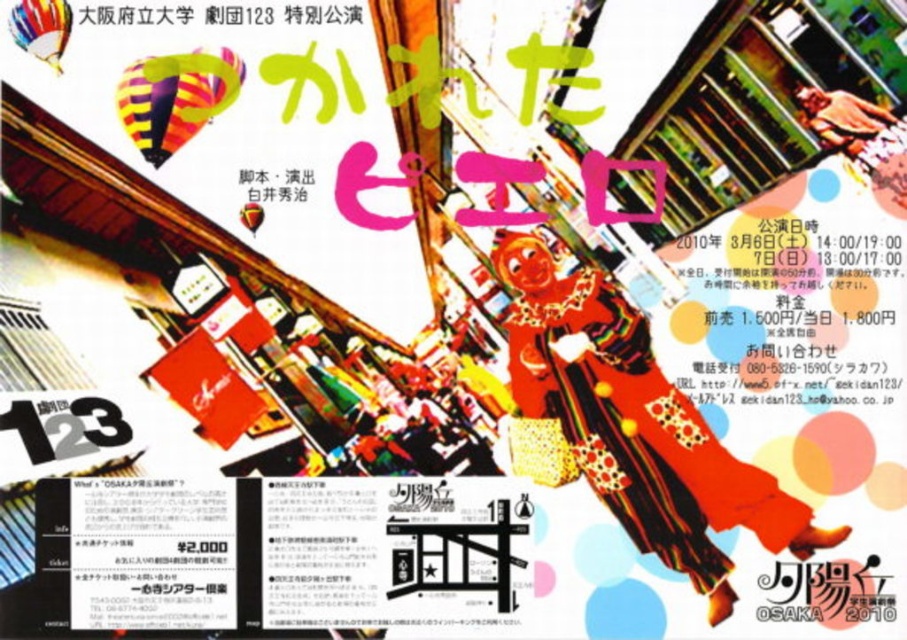
Can you confirm if matte red poster at center is wider than multicolored striped balloon at upper left?

Yes.

Between matte red poster at center and multicolored striped balloon at upper left, which one appears on the left side from the viewer's perspective?

From the viewer's perspective, multicolored striped balloon at upper left appears more on the left side.

Does point (427, 316) come behind point (163, 118)?

Yes, point (427, 316) is behind point (163, 118).

I want to click on matte red poster at center, so click(x=252, y=132).

Does point (272, 156) come in front of point (33, 32)?

No, it is behind (33, 32).

Is point (296, 273) positioned after point (45, 4)?

Yes, it is.

The height and width of the screenshot is (640, 907). I want to click on matte red poster at center, so click(252, 132).

This screenshot has height=640, width=907. I want to click on matte red poster at center, so click(x=252, y=132).

Can you confirm if multicolored striped balloon at upper left is positioned below rainbow striped balloon at upper left?

Indeed, multicolored striped balloon at upper left is positioned under rainbow striped balloon at upper left.

Which is in front, point (151, 122) or point (42, 44)?

Positioned in front is point (42, 44).

Which is in front, point (164, 112) or point (38, 3)?

Point (38, 3) is more forward.

Locate an element on the screen. The height and width of the screenshot is (640, 907). multicolored striped balloon at upper left is located at coordinates (174, 97).